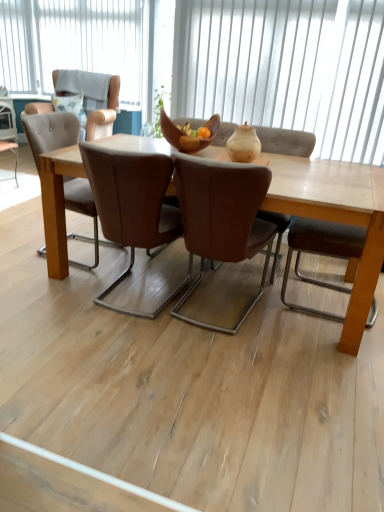
This screenshot has height=512, width=384. What do you see at coordinates (286, 69) in the screenshot?
I see `white vertical blinds at upper center, the 2th window positioned from the back` at bounding box center [286, 69].

How much space does white vertical blinds at upper center, which ranks as the second window in front-to-back order, occupy vertically?

It is 1.23 meters.

I want to click on brown leather chair at center, the 2th chair positioned from the right, so click(134, 208).

Describe the element at coordinates (134, 208) in the screenshot. I see `brown leather chair at center, the 2th chair positioned from the right` at that location.

The image size is (384, 512). Describe the element at coordinates (97, 121) in the screenshot. I see `light brown leather armchair at upper left` at that location.

You are a GUI agent. You are given a task and a screenshot of the screen. Output one action in this format:
    pyautogui.click(x=<x>, y=<y>)
    Task: Click on the wooden bowl at center
    The image size is (384, 512).
    Given the screenshot: What is the action you would take?
    pyautogui.click(x=188, y=136)

Is light brown leather armchair at upper left with white vertical blinds at upper center, which is the 1th window from bottom to top?

No, light brown leather armchair at upper left is not next to white vertical blinds at upper center, which is the 1th window from bottom to top.

Can you confirm if light brown leather armchair at upper left is bigger than white vertical blinds at upper center, the 2th window positioned from the back?

Yes, light brown leather armchair at upper left is bigger than white vertical blinds at upper center, the 2th window positioned from the back.

Is light brown leather armchair at upper left to the left of white vertical blinds at upper center, which appears as the first window when viewed from the right, from the viewer's perspective?

Yes, light brown leather armchair at upper left is to the left of white vertical blinds at upper center, which appears as the first window when viewed from the right.

Where is `armchair above the white vertical blinds at upper center, arranged as the second window when viewed from the left (from the image's perspective)`? The height and width of the screenshot is (512, 384). armchair above the white vertical blinds at upper center, arranged as the second window when viewed from the left (from the image's perspective) is located at coordinates point(97,121).

Looking at this image, from the image's perspective, which object appears higher, white vertical blinds at upper center, placed as the second window when sorted from bottom to top, or white vertical blinds at upper center, which appears as the first window when viewed from the right?

white vertical blinds at upper center, placed as the second window when sorted from bottom to top, from the image's perspective.

Based on the photo, who is bigger, white vertical blinds at upper center, the first window in the back-to-front sequence, or white vertical blinds at upper center, which appears as the first window when viewed from the right?

Bigger between the two is white vertical blinds at upper center, the first window in the back-to-front sequence.

Would you say white vertical blinds at upper center, which is counted as the 1th window, starting from the left, contains white vertical blinds at upper center, the 2th window positioned from the back?

Actually, white vertical blinds at upper center, the 2th window positioned from the back, is outside white vertical blinds at upper center, which is counted as the 1th window, starting from the left.

Does white vertical blinds at upper center, placed as the second window when sorted from right to left, lie behind white vertical blinds at upper center, which appears as the first window when viewed from the right?

Yes, white vertical blinds at upper center, placed as the second window when sorted from right to left, is further from the camera.

Is light brown leather armchair at upper left taller or shorter than brown leather chair at center, the 2th chair positioned from the right?

In the image, light brown leather armchair at upper left appears to be shorter than brown leather chair at center, the 2th chair positioned from the right.

This screenshot has width=384, height=512. There is a light brown leather armchair at upper left. What are the coordinates of `the 1st chair below it (from the image's perspective)` in the screenshot? It's located at (134, 208).

From a real-world perspective, is light brown leather armchair at upper left physically above brown leather chair at center, the 2th chair positioned from the right?

Yes, from a real-world perspective, light brown leather armchair at upper left is over brown leather chair at center, the 2th chair positioned from the right

How many degrees apart are the facing directions of light brown leather armchair at upper left and brown leather chair at center, marked as the 1th chair in a left-to-right arrangement?

They differ by 180 degrees in their facing directions.

Considering the sizes of objects matte beige vase at center and light brown wooden table at center in the image provided, who is thinner, matte beige vase at center or light brown wooden table at center?

With smaller width is matte beige vase at center.

This screenshot has width=384, height=512. I want to click on coffee table in front of the matte beige vase at center, so click(337, 220).

From the image's perspective, which is above, matte beige vase at center or light brown wooden table at center?

matte beige vase at center.

What's the angular difference between matte beige vase at center and light brown wooden table at center's facing directions?

The angular difference between matte beige vase at center and light brown wooden table at center is 0.247 degrees.

Can you confirm if white vertical blinds at upper center, the 2th window positioned from the back, is smaller than brown leather chair at center, which is the 2th chair in left-to-right order?

Yes.

From the image's perspective, is white vertical blinds at upper center, the 2th window positioned from the back, under brown leather chair at center, which is counted as the 1th chair, starting from the right?

No, from the image's perspective, white vertical blinds at upper center, the 2th window positioned from the back, is not beneath brown leather chair at center, which is counted as the 1th chair, starting from the right.

Does white vertical blinds at upper center, which is the 1th window from bottom to top, have a lesser height compared to brown leather chair at center, which is counted as the 1th chair, starting from the right?

No.

Would you say white vertical blinds at upper center, arranged as the second window when viewed from the left, is outside brown leather chair at center, which is the 2th chair in left-to-right order?

Indeed, white vertical blinds at upper center, arranged as the second window when viewed from the left, is completely outside brown leather chair at center, which is the 2th chair in left-to-right order.

The image size is (384, 512). What are the coordinates of `vase on the right of light brown leather armchair at upper left` in the screenshot? It's located at (243, 144).

From the image's perspective, is matte beige vase at center above or below light brown leather armchair at upper left?

matte beige vase at center is situated lower than light brown leather armchair at upper left in the image.

Is light brown leather armchair at upper left a part of matte beige vase at center?

Actually, light brown leather armchair at upper left is outside matte beige vase at center.

What's the angular difference between matte beige vase at center and light brown leather armchair at upper left's facing directions?

The angle between the facing direction of matte beige vase at center and the facing direction of light brown leather armchair at upper left is 1.65 degrees.

Consider the image. Can you tell me how much light brown wooden table at center and brown leather chair at center, the 2th chair positioned from the right, differ in facing direction?

178 degrees separate the facing orientations of light brown wooden table at center and brown leather chair at center, the 2th chair positioned from the right.

Visually, is light brown wooden table at center positioned to the left or to the right of brown leather chair at center, marked as the 1th chair in a left-to-right arrangement?

Based on their positions, light brown wooden table at center is located to the right of brown leather chair at center, marked as the 1th chair in a left-to-right arrangement.

Would you consider light brown wooden table at center to be distant from brown leather chair at center, marked as the 1th chair in a left-to-right arrangement?

They are positioned close to each other.

Between light brown wooden table at center and brown leather chair at center, marked as the 1th chair in a left-to-right arrangement, which one has more height?

brown leather chair at center, marked as the 1th chair in a left-to-right arrangement, is taller.

This screenshot has width=384, height=512. I want to click on armchair that appears on the left of white vertical blinds at upper center, the 2th window positioned from the back, so click(97, 121).

The image size is (384, 512). In order to click on window located behind the white vertical blinds at upper center, the second window positioned from the top in this screenshot , I will do `click(70, 42)`.

Considering their positions, is brown leather chair at center, which is the 2th chair in left-to-right order, positioned closer to matte beige vase at center than light brown leather armchair at upper left?

brown leather chair at center, which is the 2th chair in left-to-right order.

In the scene shown: Looking at the image, which one is located further to light brown wooden table at center, brown leather chair at center, marked as the 1th chair in a left-to-right arrangement, or white vertical blinds at upper center, the second window positioned from the top?

Based on the image, white vertical blinds at upper center, the second window positioned from the top, appears to be further to light brown wooden table at center.

Looking at this image, which object lies nearer to the anchor point white vertical blinds at upper center, placed as the second window when sorted from bottom to top, light brown leather armchair at upper left or light brown wooden table at center?

The object closer to white vertical blinds at upper center, placed as the second window when sorted from bottom to top, is light brown leather armchair at upper left.

Estimate the real-world distances between objects in this image. Which object is further from brown leather chair at center, the 2th chair positioned from the right, wooden bowl at center or white vertical blinds at upper center, which ranks as the second window in front-to-back order?

white vertical blinds at upper center, which ranks as the second window in front-to-back order, lies further to brown leather chair at center, the 2th chair positioned from the right, than the other object.

When comparing their distances from matte beige vase at center, does white vertical blinds at upper center, which is the 1th window from bottom to top, or wooden bowl at center seem further?

The object further to matte beige vase at center is white vertical blinds at upper center, which is the 1th window from bottom to top.

Based on the photo, when comparing their distances from white vertical blinds at upper center, the 1th window from the top, does white vertical blinds at upper center, the second window positioned from the top, or brown leather chair at center, which is counted as the 1th chair, starting from the right, seem closer?

The object closer to white vertical blinds at upper center, the 1th window from the top, is white vertical blinds at upper center, the second window positioned from the top.

Based on their spatial positions, is brown leather chair at center, the 2th chair positioned from the right, or light brown leather armchair at upper left closer to white vertical blinds at upper center, which is counted as the 1th window, starting from the left?

light brown leather armchair at upper left is positioned closer to the anchor white vertical blinds at upper center, which is counted as the 1th window, starting from the left.

Based on their spatial positions, is light brown leather armchair at upper left or white vertical blinds at upper center, which is counted as the 1th window, starting from the left, further from light brown wooden table at center?

The object further to light brown wooden table at center is white vertical blinds at upper center, which is counted as the 1th window, starting from the left.

Find the location of a particular element. This screenshot has height=512, width=384. chair located between light brown wooden table at center and light brown leather armchair at upper left in the depth direction is located at coordinates (134, 208).

Locate an element on the screen. armchair between brown leather chair at center, which is counted as the 1th chair, starting from the right, and white vertical blinds at upper center, placed as the second window when sorted from bottom to top, along the z-axis is located at coordinates (97, 121).

What are the coordinates of `vase between light brown wooden table at center and white vertical blinds at upper center, placed as the second window when sorted from right to left, in the front-back direction` in the screenshot? It's located at (243, 144).

Image resolution: width=384 pixels, height=512 pixels. Identify the location of vase between wooden bowl at center and brown leather chair at center, which is counted as the 1th chair, starting from the right, from top to bottom. (243, 144).